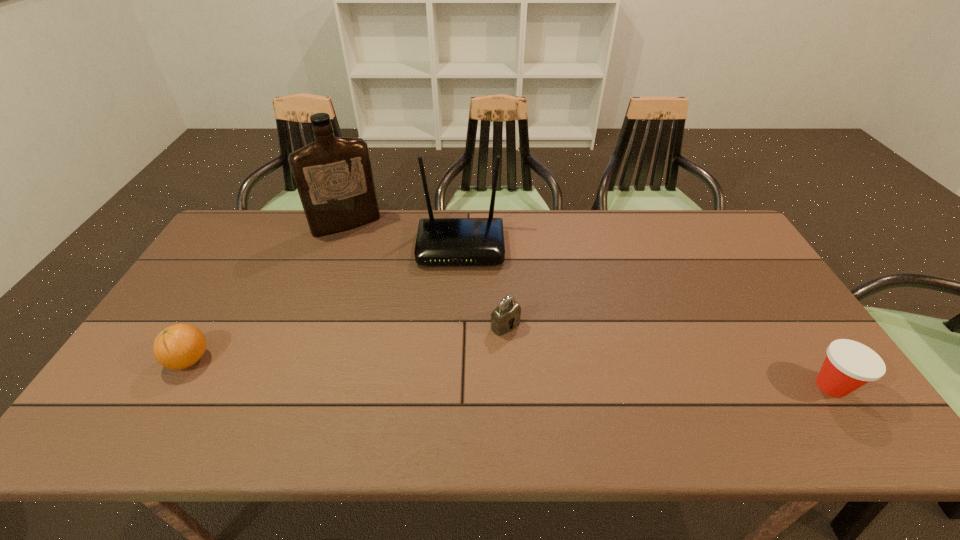
Identify the location of Dixie cup present at the near edge. (849, 365).

I want to click on object that is at the left edge, so click(179, 346).

What are the coordinates of `object located in the right edge section of the desktop` in the screenshot? It's located at (849, 365).

Identify the location of object located in the near left corner section of the desktop. This screenshot has height=540, width=960. (179, 346).

Identify the location of object located in the near right corner section of the desktop. (849, 365).

In the image, there is a desktop. At what (x,y) coordinates should I click in order to perform the action: click on free space at the far edge. Please return your answer as a coordinate pair (x, y). Image resolution: width=960 pixels, height=540 pixels. Looking at the image, I should click on (507, 230).

This screenshot has height=540, width=960. I want to click on vacant position at the near edge of the desktop, so click(238, 379).

Identify the location of free space at the left edge. The image size is (960, 540). (181, 321).

Find the location of a particular element. The image size is (960, 540). free space at the right edge of the desktop is located at coordinates (768, 355).

The height and width of the screenshot is (540, 960). I want to click on vacant region between the leftmost object and the Dixie cup, so click(511, 373).